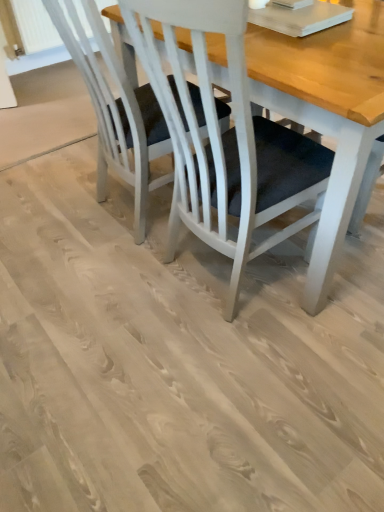
Locate an element on the screen. This screenshot has height=512, width=384. white painted wood chair at center is located at coordinates [x=116, y=110].

Image resolution: width=384 pixels, height=512 pixels. What do you see at coordinates (116, 110) in the screenshot?
I see `white painted wood chair at center` at bounding box center [116, 110].

The height and width of the screenshot is (512, 384). What do you see at coordinates (329, 116) in the screenshot?
I see `wooden table at center` at bounding box center [329, 116].

Measure the distance between point (318, 53) and camera.

Point (318, 53) is 4.02 feet from camera.

I want to click on wooden table at center, so click(x=329, y=116).

Locate an element on the screen. Image resolution: width=384 pixels, height=512 pixels. white painted wood chair at center is located at coordinates (116, 110).

Considering the positions of objects wooden table at center and white painted wood chair at center in the image provided, who is more to the right, wooden table at center or white painted wood chair at center?

wooden table at center is more to the right.

Relative to white painted wood chair at center, is wooden table at center in front or behind?

wooden table at center is in front of white painted wood chair at center.

Considering the points (285, 65) and (147, 97), which point is in front, point (285, 65) or point (147, 97)?

The point (285, 65) is more forward.

From the image's perspective, is wooden table at center on top of white painted wood chair at center?

No.

From a real-world perspective, is wooden table at center over white painted wood chair at center?

Yes, from a real-world perspective, wooden table at center is on top of white painted wood chair at center.

Between wooden table at center and white painted wood chair at center, which one has smaller width?

wooden table at center is thinner.

Who is shorter, wooden table at center or white painted wood chair at center?

Standing shorter between the two is white painted wood chair at center.

Considering the sizes of wooden table at center and white painted wood chair at center in the image, is wooden table at center bigger or smaller than white painted wood chair at center?

Clearly, wooden table at center is smaller in size than white painted wood chair at center.

Is white painted wood chair at center surrounded by wooden table at center?

That's incorrect, white painted wood chair at center is not inside wooden table at center.

Is wooden table at center touching white painted wood chair at center?

wooden table at center and white painted wood chair at center are not in contact.

From the picture: Is wooden table at center facing away from white painted wood chair at center?

No, wooden table at center is not facing the opposite direction of white painted wood chair at center.

How different are the orientations of wooden table at center and white painted wood chair at center in degrees?

The angular difference between wooden table at center and white painted wood chair at center is 0.00162 degrees.

Measure the distance between wooden table at center and white painted wood chair at center.

wooden table at center and white painted wood chair at center are 17.47 inches apart.

Locate an element on the screen. table that is above the white painted wood chair at center (from a real-world perspective) is located at coordinates (x=329, y=116).

Is white painted wood chair at center to the left or to the right of wooden table at center in the image?

In the image, white painted wood chair at center appears on the left side of wooden table at center.

Looking at this image, considering the positions of objects white painted wood chair at center and wooden table at center in the image provided, who is behind, white painted wood chair at center or wooden table at center?

white painted wood chair at center is more distant.

Is point (49, 15) closer or farther from the camera than point (336, 106)?

Point (49, 15).

From the image's perspective, does white painted wood chair at center appear higher than wooden table at center?

Yes, from the image's perspective, white painted wood chair at center is above wooden table at center.

From a real-world perspective, is white painted wood chair at center below wooden table at center?

Yes, from a real-world perspective, white painted wood chair at center is beneath wooden table at center.

Can you confirm if white painted wood chair at center is wider than wooden table at center?

Indeed, white painted wood chair at center has a greater width compared to wooden table at center.

Which of these two, white painted wood chair at center or wooden table at center, stands shorter?

white painted wood chair at center is shorter.

Can you confirm if white painted wood chair at center is smaller than wooden table at center?

No.

Is white painted wood chair at center outside of wooden table at center?

Absolutely, white painted wood chair at center is external to wooden table at center.

Are white painted wood chair at center and wooden table at center located far from each other?

They are positioned close to each other.

Is white painted wood chair at center oriented away from wooden table at center?

No, white painted wood chair at center is not facing away from wooden table at center.

At what (x,y) coordinates should I click in order to perform the action: click on chair beneath the wooden table at center (from a real-world perspective). Please return your answer as a coordinate pair (x, y). Looking at the image, I should click on (116, 110).

Where is `table that is above the white painted wood chair at center (from a real-world perspective)`? table that is above the white painted wood chair at center (from a real-world perspective) is located at coordinates (329, 116).

The width and height of the screenshot is (384, 512). What are the coordinates of `table in front of the white painted wood chair at center` in the screenshot? It's located at (329, 116).